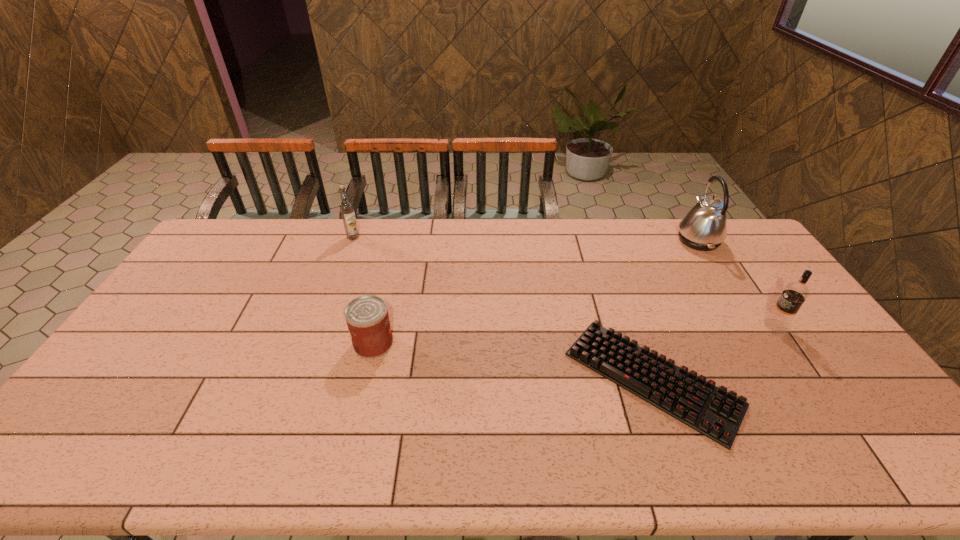
You are a GUI agent. You are given a task and a screenshot of the screen. Output one action in this format:
    pyautogui.click(x=<x>, y=<y>)
    Task: Click on the free point between the kettle and the nearer vodka
    The image size is (960, 540).
    Given the screenshot: What is the action you would take?
    pyautogui.click(x=736, y=283)

At what (x,y) coordinates should I click in order to perform the action: click on empty space that is in between the tallest object and the second shortest object. Please return your answer as a coordinate pair (x, y). This screenshot has width=960, height=540. Looking at the image, I should click on (536, 292).

Find the location of `vacant point located between the kettle and the leftmost object`. vacant point located between the kettle and the leftmost object is located at coordinates (525, 239).

The height and width of the screenshot is (540, 960). Identify the location of unoccupied area between the kettle and the computer keyboard. (675, 309).

Identify the location of vacant area that lies between the computer keyboard and the nearer vodka. Image resolution: width=960 pixels, height=540 pixels. (713, 353).

Identify the location of vacant point located between the kettle and the leftmost object. This screenshot has height=540, width=960. (525, 239).

This screenshot has height=540, width=960. Identify the location of empty location between the nearer vodka and the can. (574, 335).

I want to click on empty space between the leftmost object and the tallest object, so click(525, 239).

This screenshot has width=960, height=540. In order to click on free point between the second shortest object and the farther vodka in this screenshot , I will do `click(363, 291)`.

At what (x,y) coordinates should I click in order to perform the action: click on the second closest object to the farther vodka. Please return your answer as a coordinate pair (x, y). Looking at the image, I should click on (712, 411).